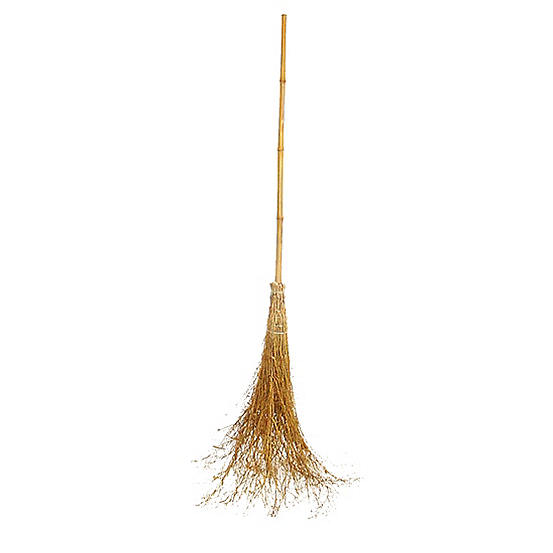
Where is `halloween decoration`? halloween decoration is located at coordinates (278, 251).